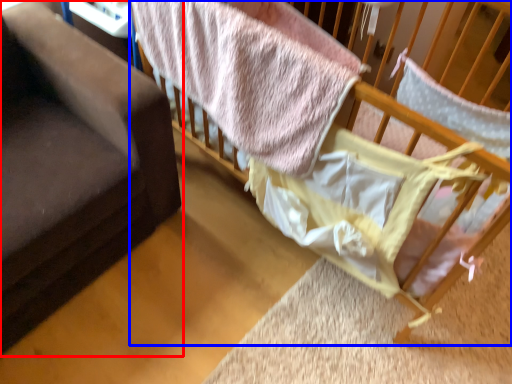
Question: Which object is further to the camera taking this photo, furniture (highlighted by a red box) or infant bed (highlighted by a blue box)?

Choices:
 (A) furniture
 (B) infant bed

Answer: (B)